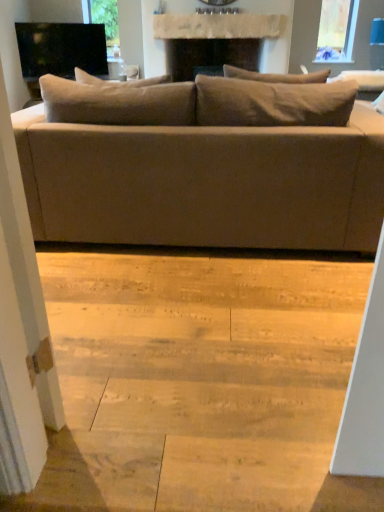
Question: Visually, is black glossy tv at upper left positioned to the left or to the right of matte beige couch at center?

Choices:
 (A) left
 (B) right

Answer: (A)

Question: From a real-world perspective, is black glossy tv at upper left positioned above or below matte beige couch at center?

Choices:
 (A) below
 (B) above

Answer: (B)

Question: Estimate the real-world distances between objects in this image. Which object is farther from the transparent glass screen door at left?

Choices:
 (A) black glossy tv at upper left
 (B) matte beige couch at center
 (C) natural wood stair at lower center

Answer: (A)

Question: Estimate the real-world distances between objects in this image. Which object is farther from the matte beige couch at center?

Choices:
 (A) transparent glass screen door at left
 (B) natural wood stair at lower center
 (C) black glossy tv at upper left

Answer: (C)